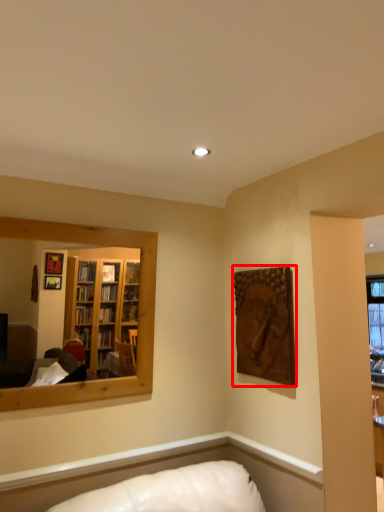
Question: From the image's perspective, what is the correct spatial relationship of picture frame (annotated by the red box) in relation to mirror?

Choices:
 (A) below
 (B) above

Answer: (A)